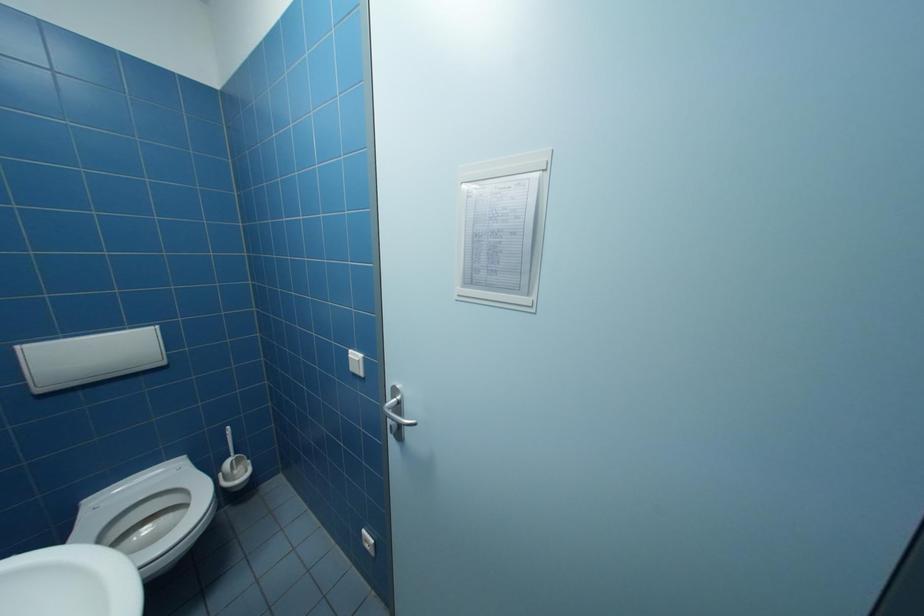
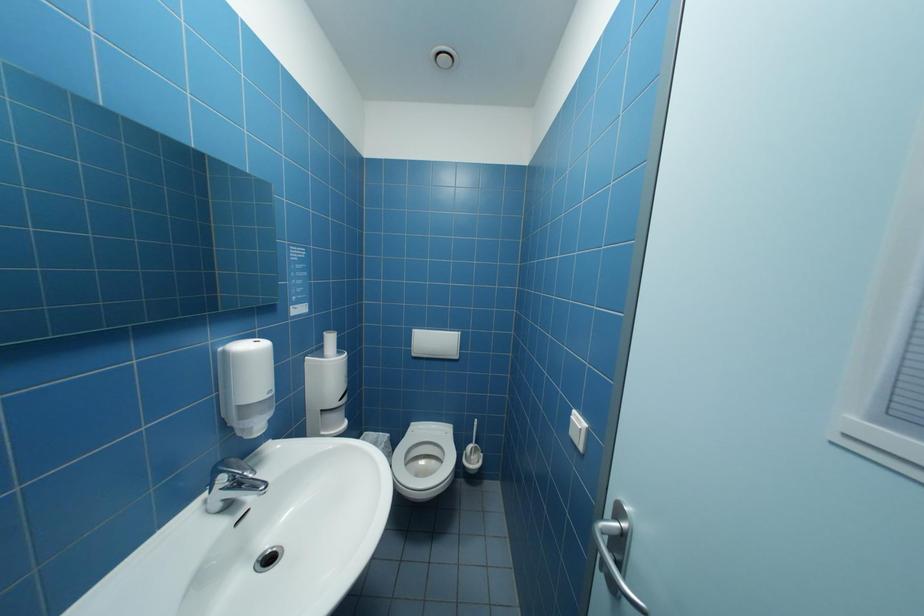
Question: How did the camera likely rotate?

Choices:
 (A) Left
 (B) Right
 (C) Up
 (D) Down

Answer: (A)